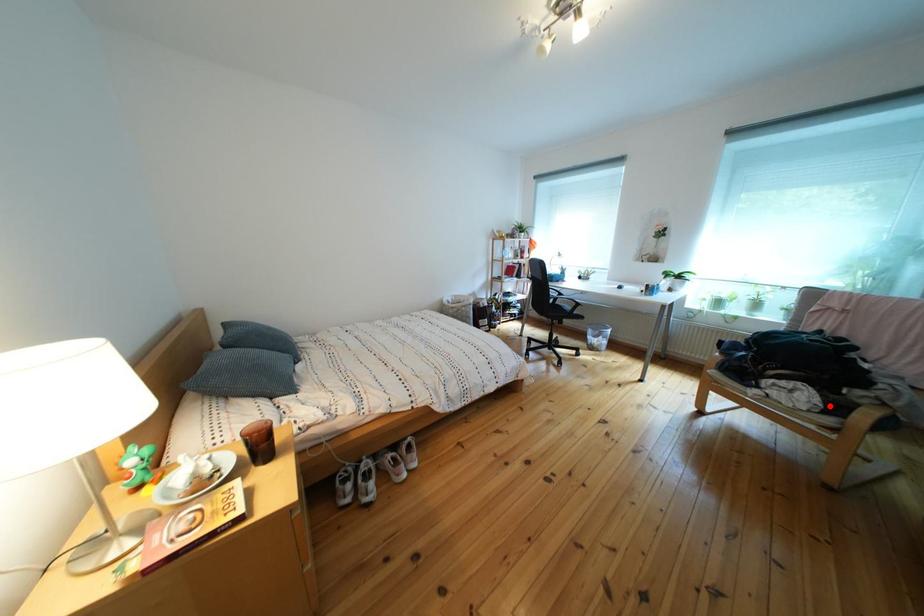
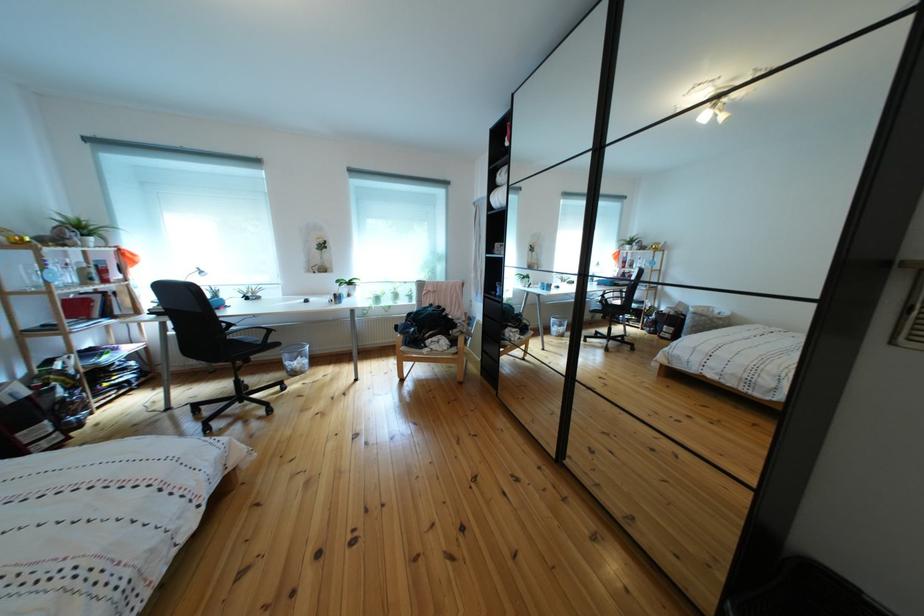
Question: I am providing you with two images of the same scene from different viewpoints. Image1 has a red point marked. In image2, the corresponding 3D location appears at what relative position? Reply with the corresponding letter.

Choices:
 (A) Closer
 (B) Farther

Answer: (B)